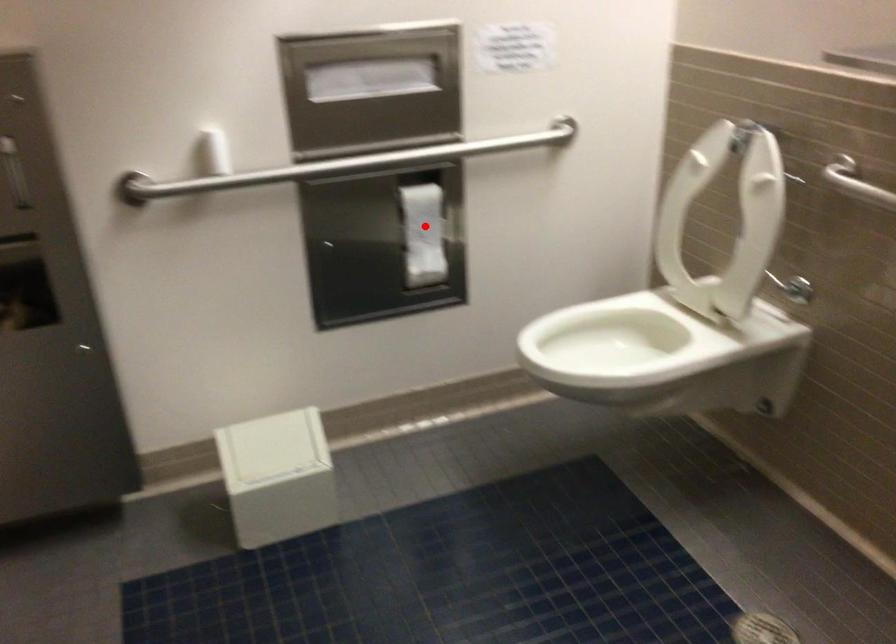
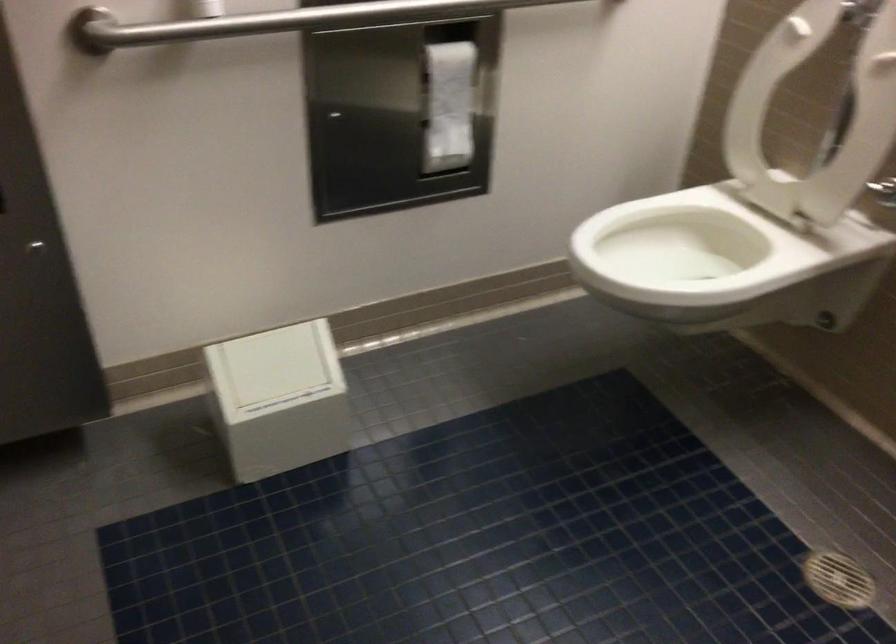
Question: I am providing you with two images of the same scene from different viewpoints. Image1 has a red point marked. In image2, the corresponding 3D location appears at what relative position? Reply with the corresponding letter.

Choices:
 (A) Closer
 (B) Farther

Answer: (A)